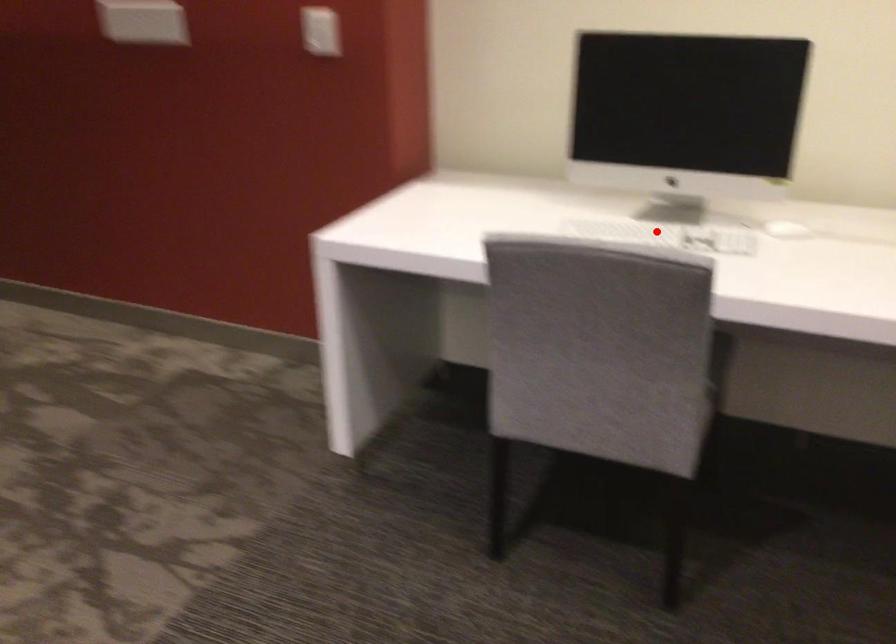
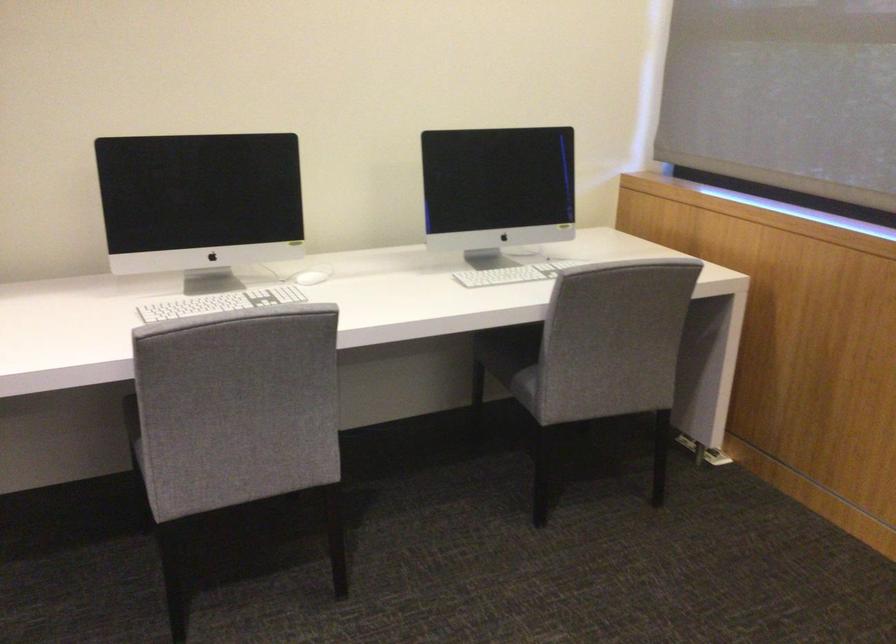
Question: I am providing you with two images of the same scene from different viewpoints. Image1 has a red point marked. In image2, the corresponding 3D location appears at what relative position? Reply with the corresponding letter.

Choices:
 (A) Closer
 (B) Farther

Answer: (B)